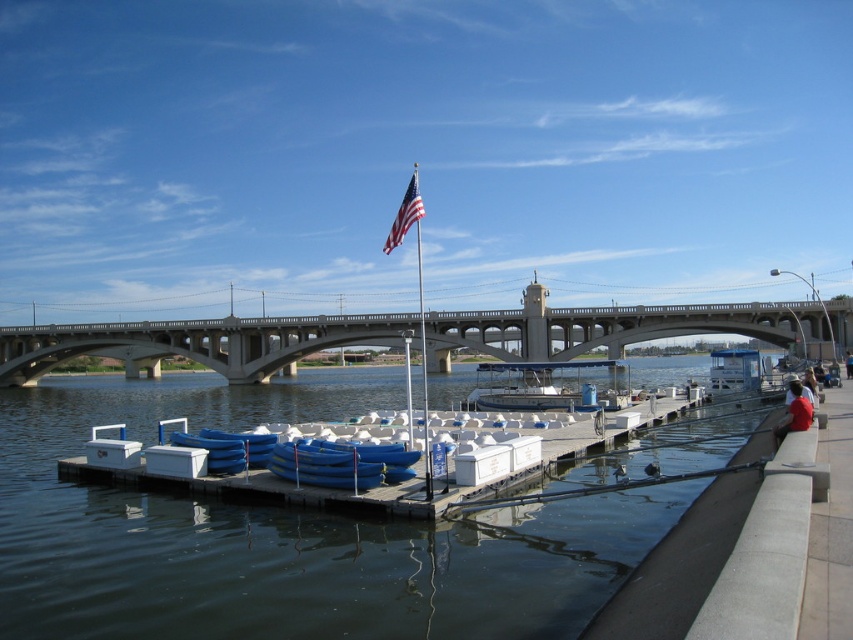
Is point (318, 579) positioned in front of point (413, 218)?

Yes, point (318, 579) is in front of point (413, 218).

Between point (335, 584) and point (395, 240), which one is positioned in front?

Point (335, 584)

Find the location of a particular element. The image size is (853, 640). clear water at dock center is located at coordinates (283, 536).

Who is more distant from viewer, (32, 344) or (421, 205)?

Positioned behind is point (32, 344).

Is concrete bridge at center thinner than american flag at upper center?

No, concrete bridge at center is not thinner than american flag at upper center.

Describe the element at coordinates (630, 326) in the screenshot. This screenshot has height=640, width=853. I see `concrete bridge at center` at that location.

The height and width of the screenshot is (640, 853). In order to click on concrete bridge at center in this screenshot , I will do `click(630, 326)`.

Does concrete bridge at center have a greater height compared to blue fabric jacket at lower right?

Indeed, concrete bridge at center has a greater height compared to blue fabric jacket at lower right.

Is point (456, 323) positioned after point (851, 360)?

That is True.

Is point (241, 362) positioned in front of point (849, 352)?

No, (241, 362) is behind (849, 352).

The image size is (853, 640). In order to click on concrete bridge at center in this screenshot , I will do `click(630, 326)`.